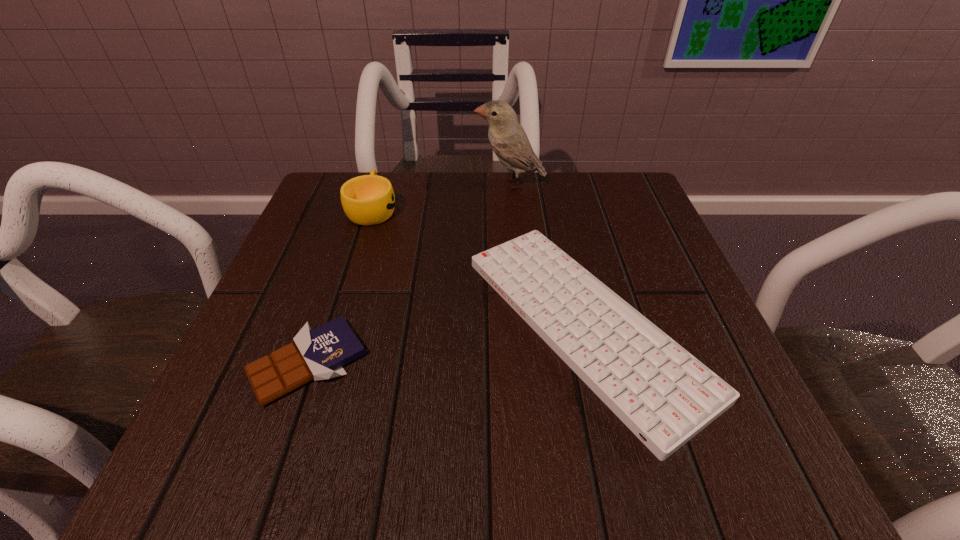
Identify the location of bird. (507, 137).

Where is `the second tallest object`? This screenshot has width=960, height=540. the second tallest object is located at coordinates (367, 200).

At what (x,y) coordinates should I click in order to perform the action: click on computer keyboard. Please return your answer as a coordinate pair (x, y). The height and width of the screenshot is (540, 960). Looking at the image, I should click on (663, 394).

In order to click on chocolate bar in this screenshot , I will do `click(319, 354)`.

Where is `vacant space located at the face of the tallest object`? This screenshot has height=540, width=960. vacant space located at the face of the tallest object is located at coordinates (411, 184).

Where is `free space located 0.220m at the face of the tallest object`? This screenshot has width=960, height=540. free space located 0.220m at the face of the tallest object is located at coordinates (380, 184).

The image size is (960, 540). Find the location of `free space located 0.050m at the face of the tallest object`. free space located 0.050m at the face of the tallest object is located at coordinates (453, 184).

Where is `vacant space situated 0.400m on the front of the cup`? The height and width of the screenshot is (540, 960). vacant space situated 0.400m on the front of the cup is located at coordinates (312, 402).

Where is `free space located on the left of the computer keyboard`? Image resolution: width=960 pixels, height=540 pixels. free space located on the left of the computer keyboard is located at coordinates (378, 324).

Where is `vacant region located 0.090m on the back of the chocolate bar`? The width and height of the screenshot is (960, 540). vacant region located 0.090m on the back of the chocolate bar is located at coordinates (335, 285).